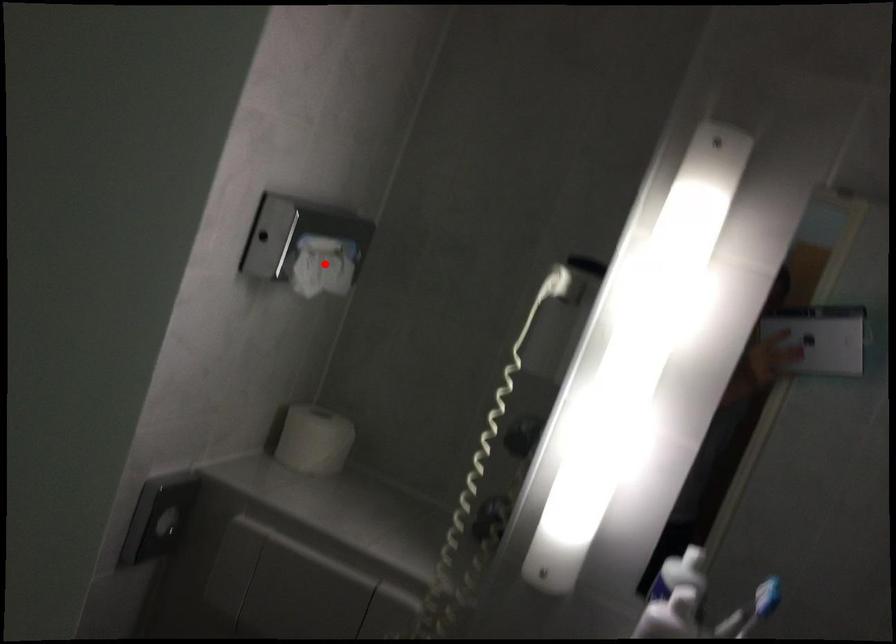
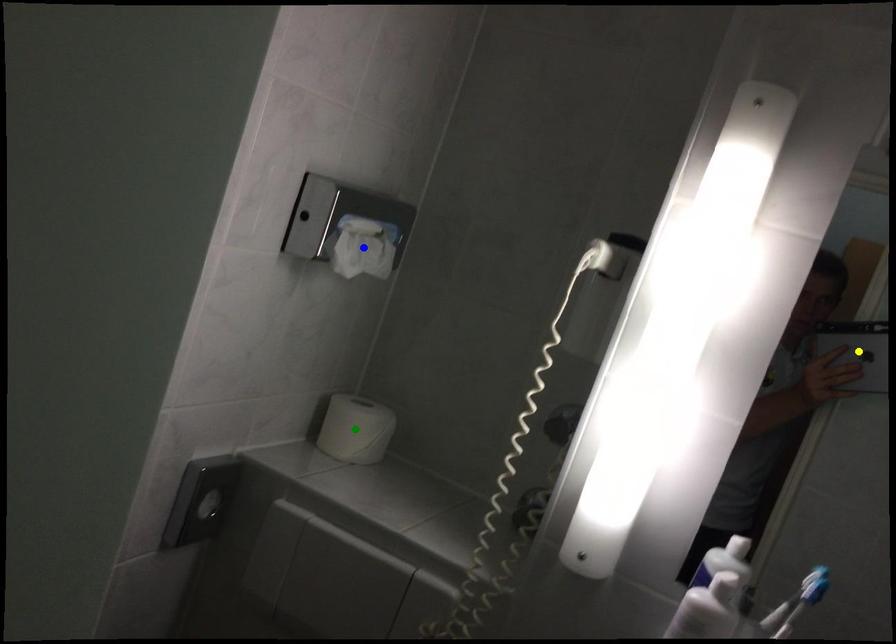
Question: I am providing you with two images of the same scene from different viewpoints. A red point is marked on the first image. You are given multiple points on the second image. Which mark in image 2 goes with the point in image 1?

Choices:
 (A) green point
 (B) yellow point
 (C) blue point

Answer: (C)